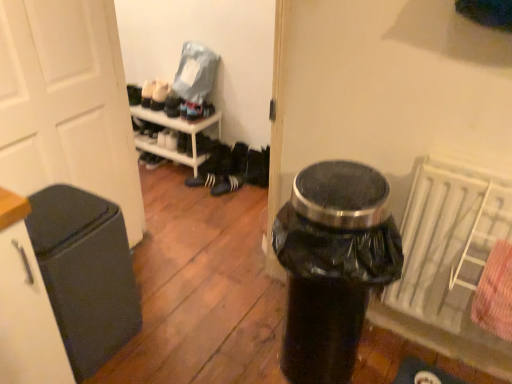
Question: Considering the positions of black suede sneakers at center, placed as the 2th footwear when sorted from left to right, and black matte trash can at left in the image, is black suede sneakers at center, placed as the 2th footwear when sorted from left to right, bigger or smaller than black matte trash can at left?

Choices:
 (A) big
 (B) small

Answer: (B)

Question: In terms of width, does black suede sneakers at center, placed as the 2th footwear when sorted from left to right, look wider or thinner when compared to black matte trash can at left?

Choices:
 (A) thin
 (B) wide

Answer: (A)

Question: Which of these objects is positioned closest to the black plastic trash can at center?

Choices:
 (A) white matte door at left
 (B) black matte trash can at left
 (C) white textured radiator at right
 (D) shiny black shoe at center
 (E) black matte sneakers at center, the first footwear viewed from the left

Answer: (C)

Question: Which object is the farthest from the white matte cabinet at left?

Choices:
 (A) white textured radiator at right
 (B) white matte door at left
 (C) black plastic trash can at center
 (D) white plastic shoe rack at upper center
 (E) black suede sneakers at center, placed as the 2th footwear when sorted from left to right

Answer: (D)